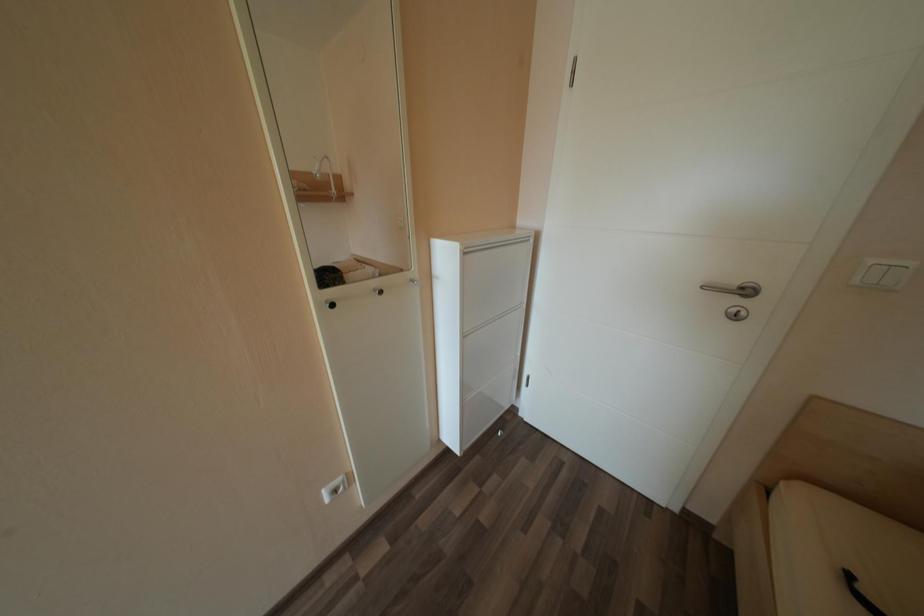
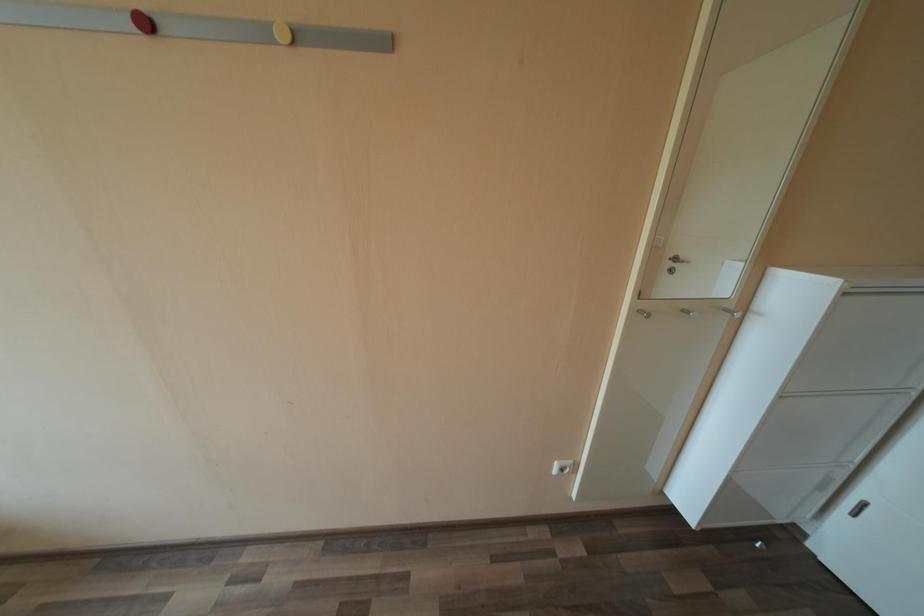
Question: How did the camera likely rotate?

Choices:
 (A) Left
 (B) Right
 (C) Up
 (D) Down

Answer: (A)